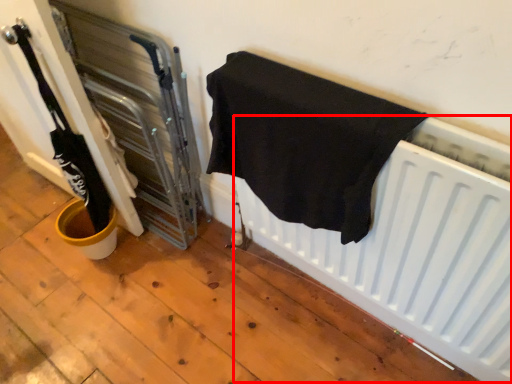
Question: From the image's perspective, what is the correct spatial positioning of radiator (annotated by the red box) in reference to towel?

Choices:
 (A) above
 (B) below

Answer: (B)